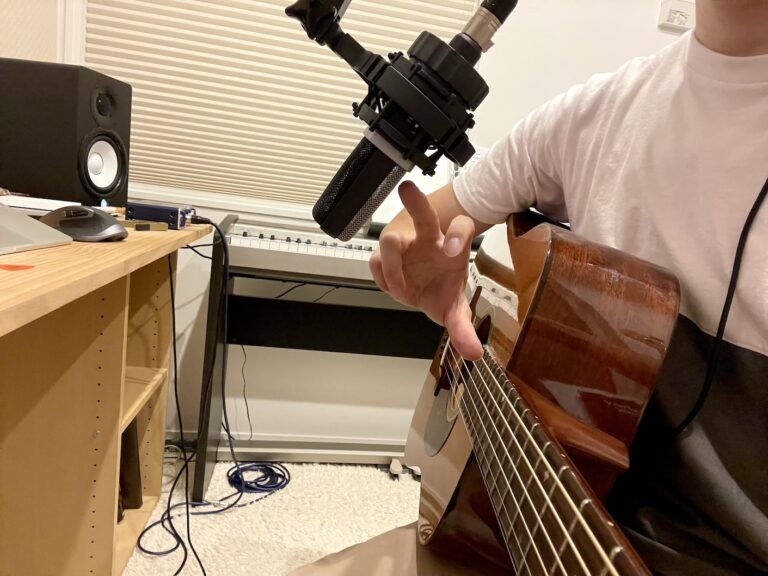
You are a GUI agent. You are given a task and a screenshot of the screen. Output one action in this format:
    pyautogui.click(x=<x>, y=<y>)
    Task: Click on the mouse
    
    Given the screenshot: What is the action you would take?
    pyautogui.click(x=84, y=223)